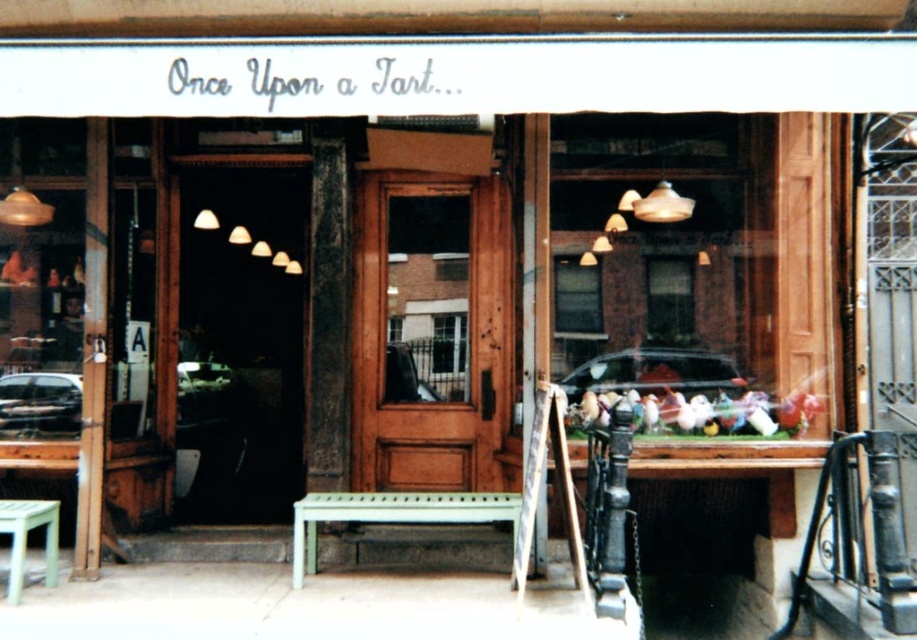
Question: Is wooden door at center to the right of green painted wood bench at center from the viewer's perspective?

Choices:
 (A) yes
 (B) no

Answer: (A)

Question: Is matte wooden door at center below green painted wood bench at center?

Choices:
 (A) no
 (B) yes

Answer: (A)

Question: Estimate the real-world distances between objects in this image. Which object is farther from the wooden door at center?

Choices:
 (A) matte wooden door at center
 (B) green painted wood bench at center
 (C) green matte stool at lower left

Answer: (A)

Question: Does wooden door at center appear on the right side of green painted wood bench at center?

Choices:
 (A) yes
 (B) no

Answer: (A)

Question: Which is farther from the wooden door at center?

Choices:
 (A) green painted wood bench at center
 (B) matte wooden door at center

Answer: (B)

Question: Which object is farther from the camera taking this photo?

Choices:
 (A) wooden door at center
 (B) matte wooden door at center
 (C) green painted wood bench at center

Answer: (B)